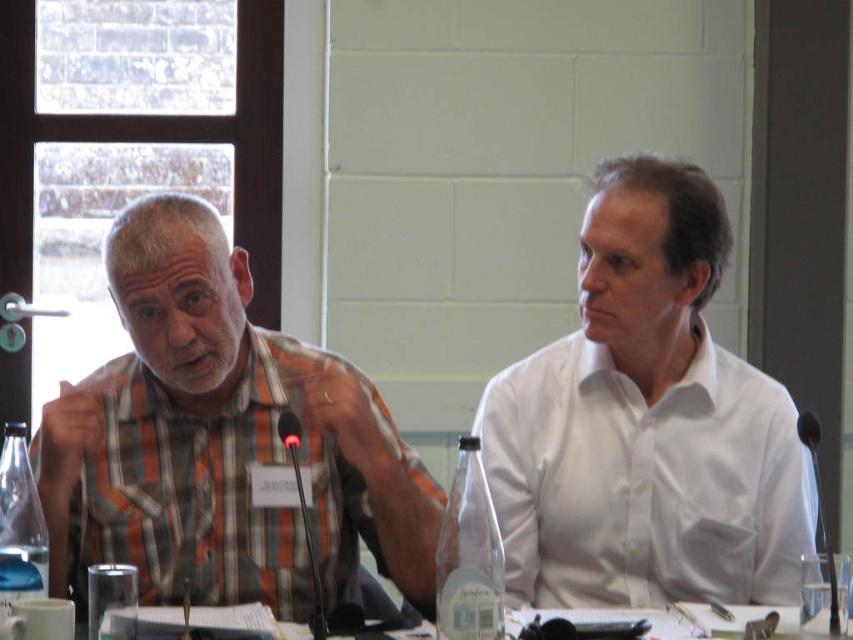
Consider the image. Can you confirm if plaid shirt at left is positioned below clear plastic table at center?

Actually, plaid shirt at left is above clear plastic table at center.

Which is below, plaid shirt at left or clear plastic table at center?

clear plastic table at center is lower down.

Who is more distant from viewer, (248, 426) or (717, 632)?

Positioned behind is point (248, 426).

The height and width of the screenshot is (640, 853). Find the location of `plaid shirt at left`. plaid shirt at left is located at coordinates click(221, 440).

Is point (648, 595) positioned behind point (190, 339)?

Yes, it is behind point (190, 339).

Is white smooth shirt at center wider than plaid shirt at left?

Incorrect, white smooth shirt at center's width does not surpass plaid shirt at left's.

Is point (581, 284) positioned after point (155, 524)?

Yes, point (581, 284) is farther from viewer.

At what (x,y) coordinates should I click in order to perform the action: click on white smooth shirt at center. Please return your answer as a coordinate pair (x, y). Image resolution: width=853 pixels, height=640 pixels. Looking at the image, I should click on (646, 422).

What do you see at coordinates (646, 422) in the screenshot? Image resolution: width=853 pixels, height=640 pixels. I see `white smooth shirt at center` at bounding box center [646, 422].

Does white smooth shirt at center appear on the right side of clear plastic table at center?

In fact, white smooth shirt at center is to the left of clear plastic table at center.

Does point (549, 387) come behind point (822, 637)?

Yes, it is.

Identify the location of white smooth shirt at center. The image size is (853, 640). (646, 422).